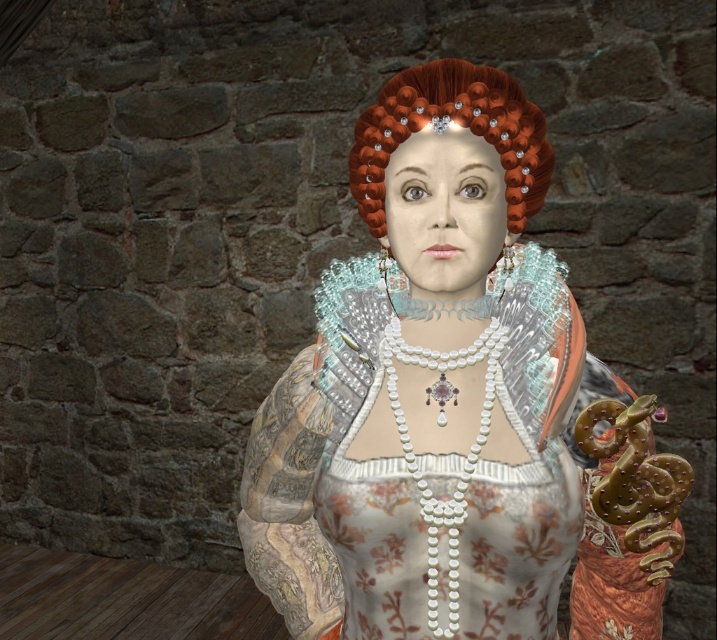
You are a photographer setting up for a Renaissance portrait. You need to ensure the matte silver gown at center and the shiny orange curls at center are both in focus. Given that the camera can only focus on objects at the same distance, will you need to adjust the focus for either of them?

The matte silver gown at center is closer to the viewer than the shiny orange curls at center, so you will need to adjust the focus since they are at different distances.

You are an art restorer examining a Renaissance painting. You notice two points on the canvas that need touchup. One is at point (336, 428) and the other at point (389, 131). Since you want to start with the one closer to the viewer, which point should you begin with?

Point (336, 428) is further to the viewer than point (389, 131), so you should start with point (336, 428).